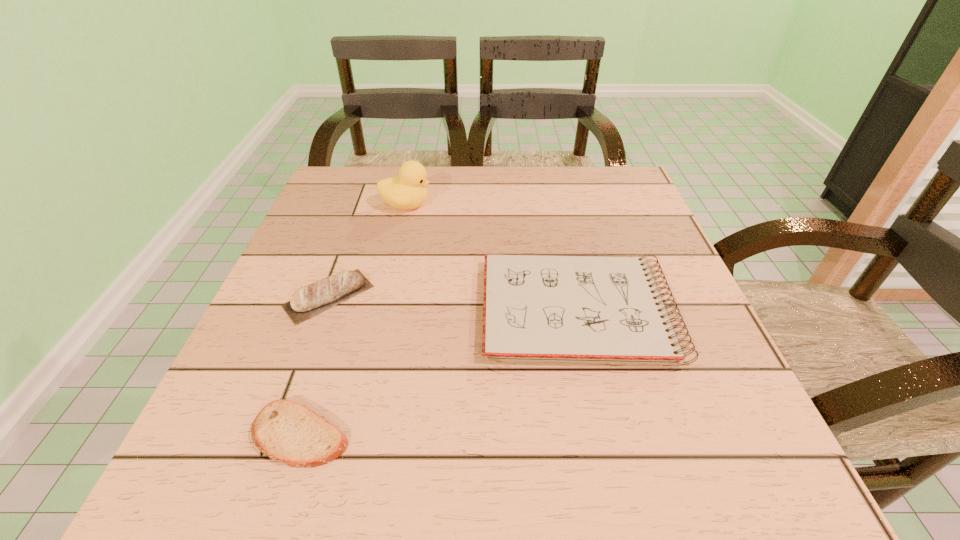
What are the coordinates of `duck` in the screenshot? It's located at [x=407, y=191].

Locate an element on the screen. This screenshot has width=960, height=540. the farthest object is located at coordinates (407, 191).

You are a GUI agent. You are given a task and a screenshot of the screen. Output one action in this format:
    pyautogui.click(x=<x>, y=<y>)
    Task: Click on the taller pita bread
    
    Given the screenshot: What is the action you would take?
    pyautogui.click(x=310, y=300)

Identify the location of notepad. Image resolution: width=960 pixels, height=540 pixels. (548, 308).

Locate an element on the screen. The width and height of the screenshot is (960, 540). the nearer pita bread is located at coordinates (287, 432).

Find the location of a particular element. Image resolution: width=960 pixels, height=540 pixels. the shortest object is located at coordinates (287, 432).

This screenshot has width=960, height=540. Find the location of `free region located 0.220m on the front-facing side of the duck`. free region located 0.220m on the front-facing side of the duck is located at coordinates (520, 205).

Where is `free space located on the right of the farther pita bread`? free space located on the right of the farther pita bread is located at coordinates (511, 296).

Find the location of a particular element. This screenshot has width=960, height=540. free spot located on the front of the notepad is located at coordinates (612, 464).

Find the location of a particular element. vacant region located on the left of the shortest object is located at coordinates (202, 434).